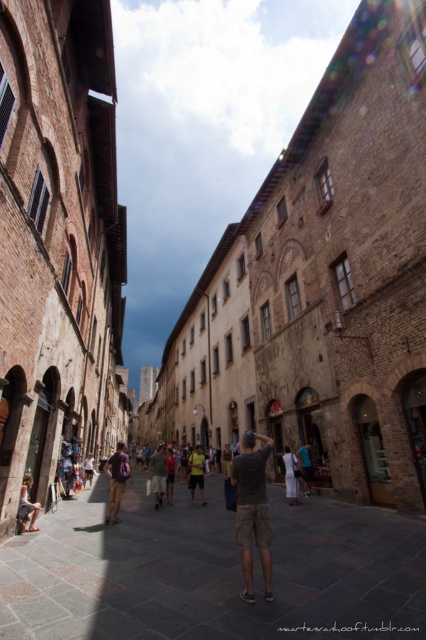
Question: From the image, what is the correct spatial relationship of brown stone alley at center in relation to light brown leather bag at lower left?

Choices:
 (A) below
 (B) above

Answer: (A)

Question: Which point is closer to the camera?

Choices:
 (A) (287, 484)
 (B) (236, 474)

Answer: (B)

Question: Does light brown backpack at center have a larger size compared to yellow-green t-shirt at center?

Choices:
 (A) yes
 (B) no

Answer: (A)

Question: Is brown stone alley at center behind white cotton dress at center?

Choices:
 (A) no
 (B) yes

Answer: (A)

Question: Which point appears farthest from the camera in this image?

Choices:
 (A) (88, 452)
 (B) (221, 579)

Answer: (A)

Question: Based on their relative distances, which object is nearer to the dark gray cotton t-shirt at center?

Choices:
 (A) light brown leather bag at lower left
 (B) brown stone alley at center
 (C) yellow-green t-shirt at center
 (D) light brown leather backpack at center

Answer: (B)